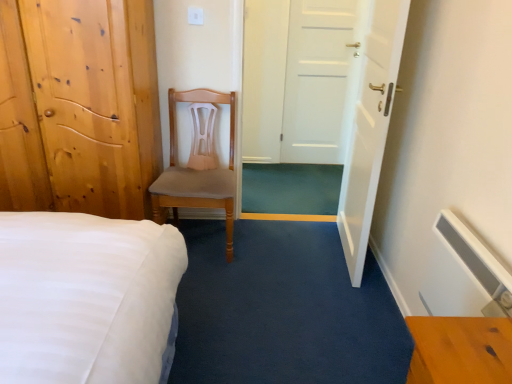
Question: Is white glossy door at center, placed as the first door when sorted from right to left, inside light brown wood chair at center?

Choices:
 (A) yes
 (B) no

Answer: (B)

Question: Is light brown wood chair at center facing towards white glossy door at center, placed as the first door when sorted from right to left?

Choices:
 (A) yes
 (B) no

Answer: (B)

Question: Considering the relative sizes of light brown wood chair at center and white glossy door at center, placed as the first door when sorted from right to left, in the image provided, is light brown wood chair at center thinner than white glossy door at center, placed as the first door when sorted from right to left,?

Choices:
 (A) no
 (B) yes

Answer: (A)

Question: Is light brown wood chair at center oriented away from white glossy door at center, the 3th door viewed from the left?

Choices:
 (A) no
 (B) yes

Answer: (A)

Question: Is light brown wood chair at center not inside white glossy door at center, placed as the first door when sorted from right to left?

Choices:
 (A) yes
 (B) no

Answer: (A)

Question: From a real-world perspective, is white matte door at center, arranged as the 2th door when viewed from the left, positioned above or below light brown wood chair at center?

Choices:
 (A) below
 (B) above

Answer: (B)

Question: Considering the positions of white matte door at center, arranged as the 2th door when viewed from the left, and light brown wood chair at center in the image, is white matte door at center, arranged as the 2th door when viewed from the left, wider or thinner than light brown wood chair at center?

Choices:
 (A) wide
 (B) thin

Answer: (B)

Question: Does point (302, 137) appear closer or farther from the camera than point (215, 188)?

Choices:
 (A) closer
 (B) farther

Answer: (B)

Question: Is white matte door at center, which appears as the 2th door when viewed from the right, in front of or behind light brown wood chair at center in the image?

Choices:
 (A) front
 (B) behind

Answer: (B)

Question: Considering their positions, is light brown wooden door at left, which is the first door from left to right, located in front of or behind white matte door at center, which appears as the 2th door when viewed from the right?

Choices:
 (A) behind
 (B) front

Answer: (B)

Question: Is point (78, 66) closer or farther from the camera than point (316, 137)?

Choices:
 (A) farther
 (B) closer

Answer: (B)

Question: From the image's perspective, is light brown wooden door at left, which is the first door from left to right, above or below white matte door at center, which appears as the 2th door when viewed from the right?

Choices:
 (A) below
 (B) above

Answer: (A)

Question: Considering the positions of light brown wooden door at left, which is the first door from left to right, and white matte door at center, which appears as the 2th door when viewed from the right, in the image, is light brown wooden door at left, which is the first door from left to right, bigger or smaller than white matte door at center, which appears as the 2th door when viewed from the right,?

Choices:
 (A) big
 (B) small

Answer: (A)

Question: Based on their sizes in the image, would you say white glossy door at center, the 3th door viewed from the left, is bigger or smaller than light brown wooden door at left, the third door positioned from the right?

Choices:
 (A) small
 (B) big

Answer: (A)

Question: Looking at their shapes, would you say white glossy door at center, placed as the first door when sorted from right to left, is wider or thinner than light brown wooden door at left, the third door positioned from the right?

Choices:
 (A) thin
 (B) wide

Answer: (A)